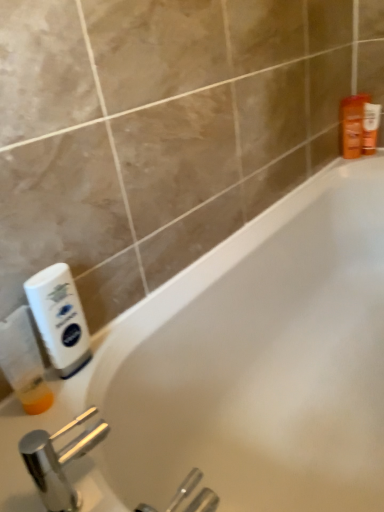
Question: Considering the relative sizes of white glossy bathtub at center and orange matte lotion at upper right, marked as the 1th toiletry in a right-to-left arrangement, in the image provided, is white glossy bathtub at center smaller than orange matte lotion at upper right, marked as the 1th toiletry in a right-to-left arrangement,?

Choices:
 (A) yes
 (B) no

Answer: (B)

Question: Could you tell me if white glossy bathtub at center is facing orange matte lotion at upper right, the second toiletry positioned from the left?

Choices:
 (A) yes
 (B) no

Answer: (B)

Question: From the image's perspective, does white glossy bathtub at center appear lower than orange matte lotion at upper right, marked as the 1th toiletry in a right-to-left arrangement?

Choices:
 (A) no
 (B) yes

Answer: (B)

Question: Is white glossy bathtub at center outside of orange matte lotion at upper right, marked as the 1th toiletry in a right-to-left arrangement?

Choices:
 (A) yes
 (B) no

Answer: (A)

Question: Does white glossy bathtub at center appear on the left side of orange matte lotion at upper right, the second toiletry positioned from the left?

Choices:
 (A) no
 (B) yes

Answer: (B)

Question: Can you see white glossy bathtub at center touching orange matte lotion at upper right, marked as the 1th toiletry in a right-to-left arrangement?

Choices:
 (A) no
 (B) yes

Answer: (A)

Question: Is white glossy bathtub at center taller than white plastic bottle at left, acting as the 2th cleaning product starting from the left?

Choices:
 (A) yes
 (B) no

Answer: (A)

Question: Does white glossy bathtub at center have a lesser width compared to white plastic bottle at left, the 1th cleaning product in the right-to-left sequence?

Choices:
 (A) no
 (B) yes

Answer: (A)

Question: Can you confirm if white glossy bathtub at center is positioned to the left of white plastic bottle at left, acting as the 2th cleaning product starting from the left?

Choices:
 (A) yes
 (B) no

Answer: (B)

Question: Can you confirm if white glossy bathtub at center is bigger than white plastic bottle at left, the 1th cleaning product in the right-to-left sequence?

Choices:
 (A) no
 (B) yes

Answer: (B)

Question: Is the position of white glossy bathtub at center less distant than that of white plastic bottle at left, the 1th cleaning product in the right-to-left sequence?

Choices:
 (A) yes
 (B) no

Answer: (A)

Question: Can we say white glossy bathtub at center lies outside white plastic bottle at left, acting as the 2th cleaning product starting from the left?

Choices:
 (A) no
 (B) yes

Answer: (B)

Question: Is white glossy bathtub at center oriented away from translucent plastic bottle at left, acting as the 1th cleaning product starting from the left?

Choices:
 (A) no
 (B) yes

Answer: (A)